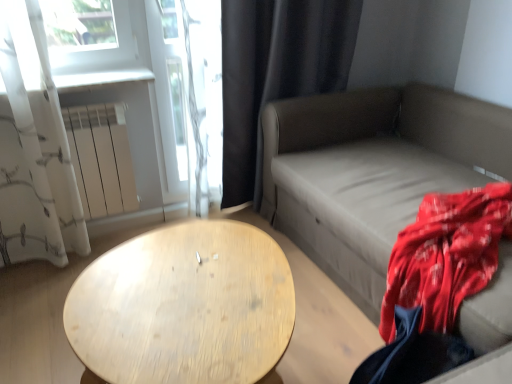
This screenshot has width=512, height=384. I want to click on white sheer curtain at left, the 2th curtain from the right, so click(x=35, y=148).

Measure the distance between point (260, 256) and camera.

A distance of 1.35 meters exists between point (260, 256) and camera.

In order to face white matte radiator at left, should I rotate leftwards or rightwards?

Turn left approximately 19.507 degrees to face it.

What is the approximate width of black fabric curtain at upper right, the first curtain viewed from the right?

black fabric curtain at upper right, the first curtain viewed from the right, is 10.52 inches in width.

Identify the location of black fabric curtain at upper right, the first curtain viewed from the right. Image resolution: width=512 pixels, height=384 pixels. (276, 73).

The width and height of the screenshot is (512, 384). Identify the location of white sheer curtain at left, the 2th curtain from the right. (35, 148).

From a real-world perspective, is matte gray couch at right positioned under white sheer curtain at left, the 2th curtain from the right, based on gravity?

Yes, from a real-world perspective, matte gray couch at right is beneath white sheer curtain at left, the 2th curtain from the right.

How different are the orientations of matte gray couch at right and white sheer curtain at left, the 1th curtain viewed from the left, in degrees?

The facing directions of matte gray couch at right and white sheer curtain at left, the 1th curtain viewed from the left, are 90.3 degrees apart.

Can you confirm if matte gray couch at right is thinner than white sheer curtain at left, the 1th curtain viewed from the left?

Incorrect, the width of matte gray couch at right is not less than that of white sheer curtain at left, the 1th curtain viewed from the left.

At what (x,y) coordinates should I click in order to perform the action: click on curtain that is the 2nd one when counting leftward from the matte gray couch at right. Please return your answer as a coordinate pair (x, y). Image resolution: width=512 pixels, height=384 pixels. Looking at the image, I should click on (35, 148).

Considering the sizes of black fabric curtain at upper right, the 2th curtain positioned from the left, and white matte radiator at left in the image, is black fabric curtain at upper right, the 2th curtain positioned from the left, wider or thinner than white matte radiator at left?

In the image, black fabric curtain at upper right, the 2th curtain positioned from the left, appears to be wider than white matte radiator at left.

Is black fabric curtain at upper right, the first curtain viewed from the right, completely or partially outside of white matte radiator at left?

Yes, black fabric curtain at upper right, the first curtain viewed from the right, is not within white matte radiator at left.

Is point (250, 120) positioned in front of point (87, 218)?

No, it is not.

How distant is black fabric curtain at upper right, the first curtain viewed from the right, from white matte radiator at left?

A distance of 29.69 inches exists between black fabric curtain at upper right, the first curtain viewed from the right, and white matte radiator at left.

From the image's perspective, does light wood/texture table at center appear lower than matte gray couch at right?

Yes, from the image's perspective, light wood/texture table at center is beneath matte gray couch at right.

Considering the sizes of objects light wood/texture table at center and matte gray couch at right in the image provided, who is shorter, light wood/texture table at center or matte gray couch at right?

With less height is light wood/texture table at center.

Is point (249, 321) farther from viewer compared to point (359, 216)?

No, it is not.

Between light wood/texture table at center and matte gray couch at right, which one has larger width?

matte gray couch at right.

Is light wood/texture table at center completely or partially outside of black fabric curtain at upper right, the first curtain viewed from the right?

Absolutely, light wood/texture table at center is external to black fabric curtain at upper right, the first curtain viewed from the right.

Based on the photo, from the image's perspective, between light wood/texture table at center and black fabric curtain at upper right, the 2th curtain positioned from the left, who is located below?

light wood/texture table at center is shown below in the image.

Is light wood/texture table at center oriented away from black fabric curtain at upper right, the 2th curtain positioned from the left?

No.

Considering the relative sizes of light wood/texture table at center and black fabric curtain at upper right, the first curtain viewed from the right, in the image provided, is light wood/texture table at center thinner than black fabric curtain at upper right, the first curtain viewed from the right,?

No.

Is white sheer curtain at left, the 2th curtain from the right, facing towards matte gray couch at right?

No, white sheer curtain at left, the 2th curtain from the right, is not aimed at matte gray couch at right.

From the image's perspective, which object appears higher, white sheer curtain at left, the 2th curtain from the right, or matte gray couch at right?

white sheer curtain at left, the 2th curtain from the right.

Is white sheer curtain at left, the 2th curtain from the right, closer to the viewer compared to matte gray couch at right?

No, white sheer curtain at left, the 2th curtain from the right, is further to the viewer.

Would you say white sheer curtain at left, the 1th curtain viewed from the left, contains matte gray couch at right?

No.

From the image's perspective, is matte gray couch at right over light wood/texture table at center?

Yes, from the image's perspective, matte gray couch at right is above light wood/texture table at center.

Can light wood/texture table at center be found inside matte gray couch at right?

That's incorrect, light wood/texture table at center is not inside matte gray couch at right.

Does matte gray couch at right have a smaller size compared to light wood/texture table at center?

Actually, matte gray couch at right might be larger than light wood/texture table at center.

Is black fabric curtain at upper right, the first curtain viewed from the right, aimed at white sheer curtain at left, the 1th curtain viewed from the left?

No, black fabric curtain at upper right, the first curtain viewed from the right, is not facing towards white sheer curtain at left, the 1th curtain viewed from the left.

Considering the positions of objects black fabric curtain at upper right, the first curtain viewed from the right, and white sheer curtain at left, the 1th curtain viewed from the left, in the image provided, who is more to the right, black fabric curtain at upper right, the first curtain viewed from the right, or white sheer curtain at left, the 1th curtain viewed from the left,?

Positioned to the right is black fabric curtain at upper right, the first curtain viewed from the right.

From a real-world perspective, which is physically below, black fabric curtain at upper right, the 2th curtain positioned from the left, or white sheer curtain at left, the 1th curtain viewed from the left?

In real-world perspective, black fabric curtain at upper right, the 2th curtain positioned from the left, is lower.

Considering the positions of point (233, 189) and point (40, 238), is point (233, 189) closer or farther from the camera than point (40, 238)?

Point (233, 189) appears to be farther away from the viewer than point (40, 238).

Image resolution: width=512 pixels, height=384 pixels. Find the location of `the 1st curtain behind when counting from the matte gray couch at right`. the 1st curtain behind when counting from the matte gray couch at right is located at coordinates (35, 148).

Identify the location of radiator that appears below the black fabric curtain at upper right, the 2th curtain positioned from the left (from the image's perspective). The width and height of the screenshot is (512, 384). (101, 159).

From the image, which object appears to be nearer to white matte radiator at left, white sheer curtain at left, the 2th curtain from the right, or matte gray couch at right?

white sheer curtain at left, the 2th curtain from the right, is closer to white matte radiator at left.

Which object lies nearer to the anchor point white matte radiator at left, white sheer curtain at left, the 1th curtain viewed from the left, or light wood/texture table at center?

white sheer curtain at left, the 1th curtain viewed from the left, lies closer to white matte radiator at left than the other object.

When comparing their distances from white sheer curtain at left, the 1th curtain viewed from the left, does white matte radiator at left or black fabric curtain at upper right, the first curtain viewed from the right, seem further?

Among the two, black fabric curtain at upper right, the first curtain viewed from the right, is located further to white sheer curtain at left, the 1th curtain viewed from the left.

When comparing their distances from matte gray couch at right, does white sheer curtain at left, the 2th curtain from the right, or white matte radiator at left seem further?

Based on the image, white sheer curtain at left, the 2th curtain from the right, appears to be further to matte gray couch at right.

Looking at this image, looking at the image, which one is located closer to black fabric curtain at upper right, the 2th curtain positioned from the left, light wood/texture table at center or matte gray couch at right?

Based on the image, matte gray couch at right appears to be nearer to black fabric curtain at upper right, the 2th curtain positioned from the left.

When comparing their distances from white matte radiator at left, does matte gray couch at right or black fabric curtain at upper right, the 2th curtain positioned from the left, seem further?

matte gray couch at right.

From the image, which object appears to be farther from black fabric curtain at upper right, the 2th curtain positioned from the left, white matte radiator at left or white sheer curtain at left, the 2th curtain from the right?

white sheer curtain at left, the 2th curtain from the right, lies further to black fabric curtain at upper right, the 2th curtain positioned from the left, than the other object.

Considering their positions, is matte gray couch at right positioned closer to white matte radiator at left than white sheer curtain at left, the 1th curtain viewed from the left?

white sheer curtain at left, the 1th curtain viewed from the left, is closer to white matte radiator at left.

Where is `radiator located between white sheer curtain at left, the 2th curtain from the right, and matte gray couch at right in the left-right direction`? radiator located between white sheer curtain at left, the 2th curtain from the right, and matte gray couch at right in the left-right direction is located at coordinates (101, 159).

Where is `table situated between white matte radiator at left and matte gray couch at right from left to right`? This screenshot has width=512, height=384. table situated between white matte radiator at left and matte gray couch at right from left to right is located at coordinates (184, 306).

Find the location of a particular element. The image size is (512, 384). table between white sheer curtain at left, the 1th curtain viewed from the left, and matte gray couch at right, in the horizontal direction is located at coordinates (184, 306).

Find the location of a particular element. This screenshot has width=512, height=384. table between white sheer curtain at left, the 1th curtain viewed from the left, and black fabric curtain at upper right, the 2th curtain positioned from the left, in the horizontal direction is located at coordinates tap(184, 306).